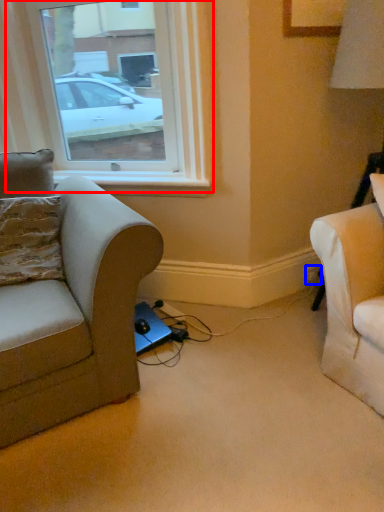
Question: Which object is closer to the camera taking this photo, window (highlighted by a red box) or electric outlet (highlighted by a blue box)?

Choices:
 (A) window
 (B) electric outlet

Answer: (A)